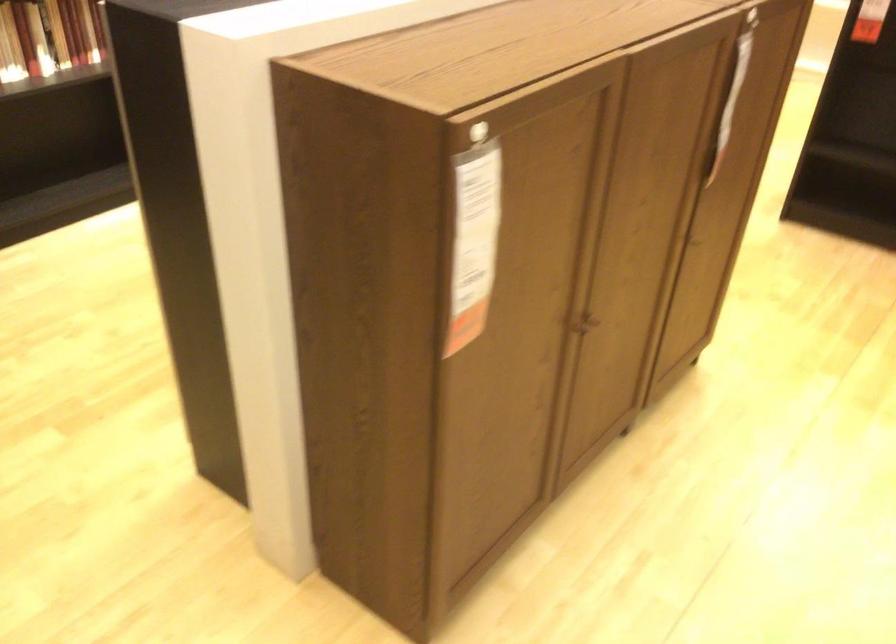
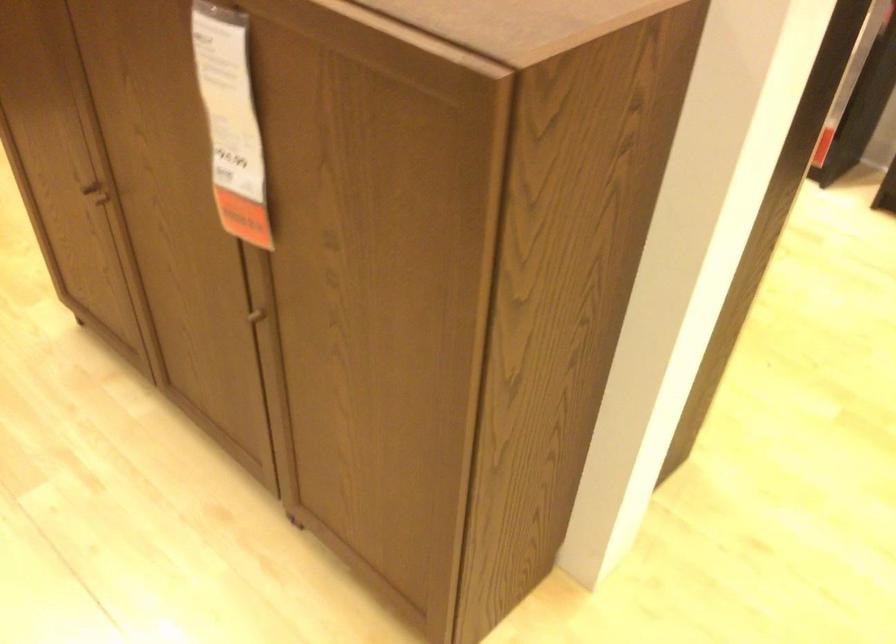
Where in the second image is the point corresponding to pixel 700 232 from the first image?

(262, 314)